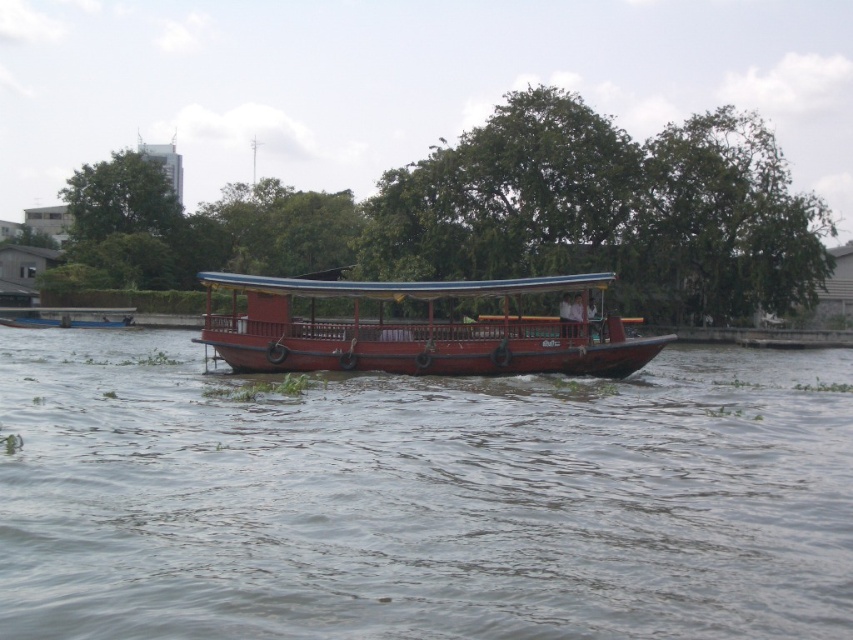
This screenshot has width=853, height=640. Describe the element at coordinates (421, 499) in the screenshot. I see `brown wooden river at center` at that location.

Can you confirm if brown wooden river at center is positioned to the left of green leafy tree at center?

Indeed, brown wooden river at center is positioned on the left side of green leafy tree at center.

The height and width of the screenshot is (640, 853). What are the coordinates of `brown wooden river at center` in the screenshot? It's located at (421, 499).

Between green leafy tree at center and wooden boat at center, which one is positioned lower?

wooden boat at center

Is green leafy tree at center further to camera compared to wooden boat at center?

Yes, it is behind wooden boat at center.

Describe the element at coordinates (496, 216) in the screenshot. I see `green leafy tree at center` at that location.

Find the location of `green leafy tree at center`. green leafy tree at center is located at coordinates (496, 216).

Who is positioned more to the left, brown wooden river at center or wooden boat at center?

wooden boat at center is more to the left.

What do you see at coordinates (421, 499) in the screenshot? Image resolution: width=853 pixels, height=640 pixels. I see `brown wooden river at center` at bounding box center [421, 499].

Which is in front, point (165, 504) or point (614, 344)?

Point (165, 504) is in front.

Where is `brown wooden river at center`? Image resolution: width=853 pixels, height=640 pixels. brown wooden river at center is located at coordinates (421, 499).